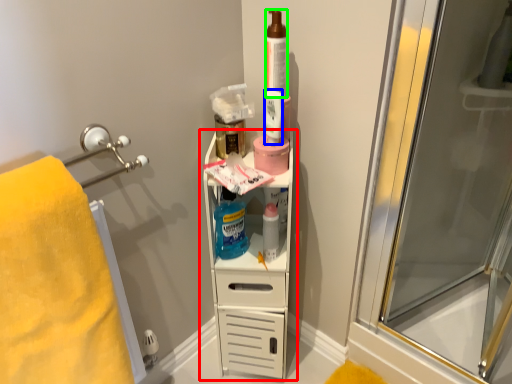
Question: Based on their relative distances, which object is farther from shelf (highlighted by a red box)? Choose from mouthwash (highlighted by a blue box) and toiletry (highlighted by a green box).

Choices:
 (A) mouthwash
 (B) toiletry

Answer: (B)